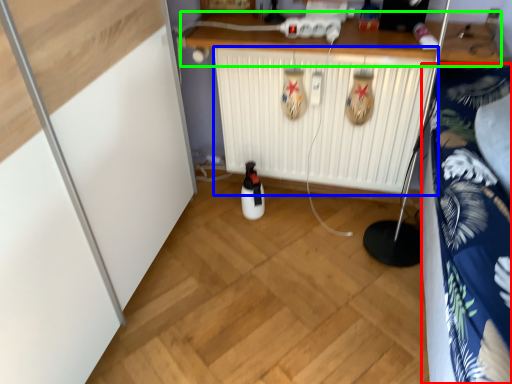
Question: Based on their relative distances, which object is farther from bedding (highlighted by a red box)? Choose from radiator (highlighted by a blue box) and counter (highlighted by a green box).

Choices:
 (A) radiator
 (B) counter

Answer: (A)